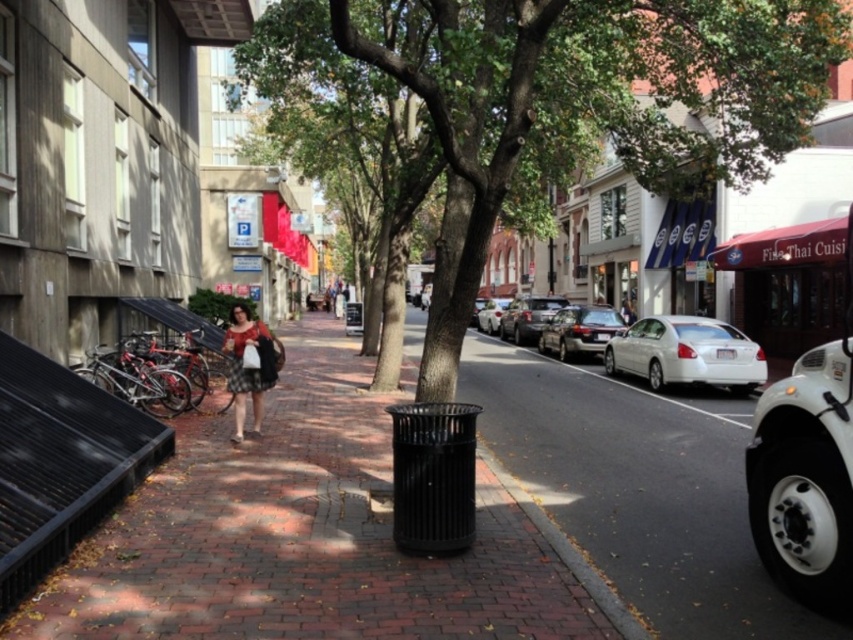
Consider the image. You are standing at the entrance of the building and want to throw away a bag. The entrance is 10 feet away from the camera. Is the black metal trash can at center within your reach without moving more than 10 feet from the entrance?

The black metal trash can at center is 13.64 feet away from the camera. Since the entrance is 10 feet away from the camera, the trash can is 3.64 feet beyond the entrance. Therefore, you would need to move more than 10 feet from the entrance to reach it.

In the scene shown: You are a delivery person who needs to park your 4.5 meter long truck in this street. There is a shiny black sedan at center and a white matte car at center parked ahead. Which car takes up more space on the road?

The white matte car at center takes up more space on the road since it is longer than the shiny black sedan at center, which is shorter according to the description.